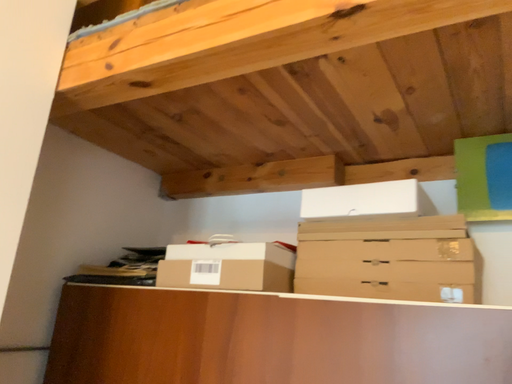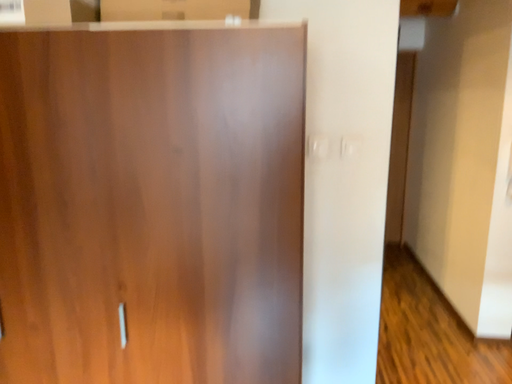
Question: Which way did the camera rotate in the video?

Choices:
 (A) rotated downward
 (B) rotated upward

Answer: (A)